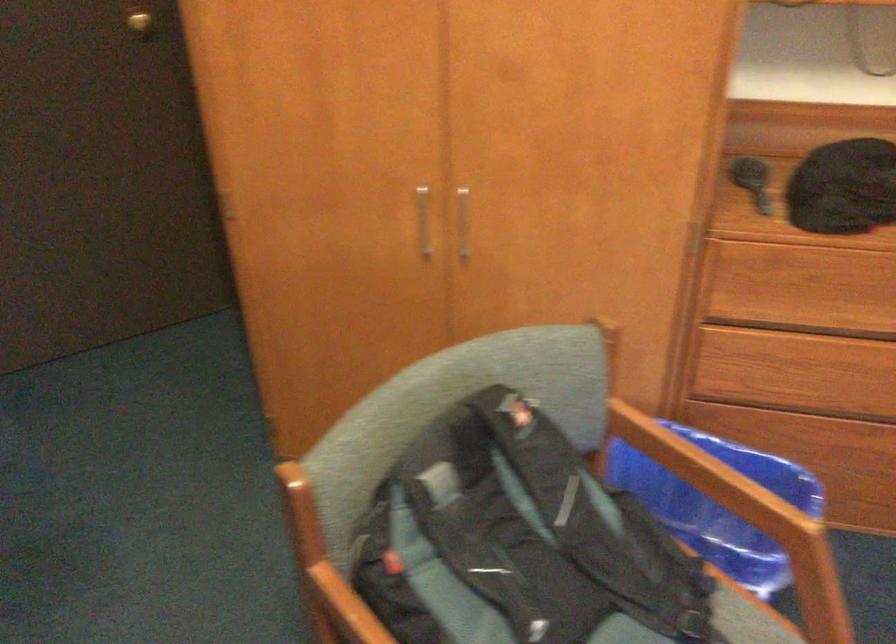
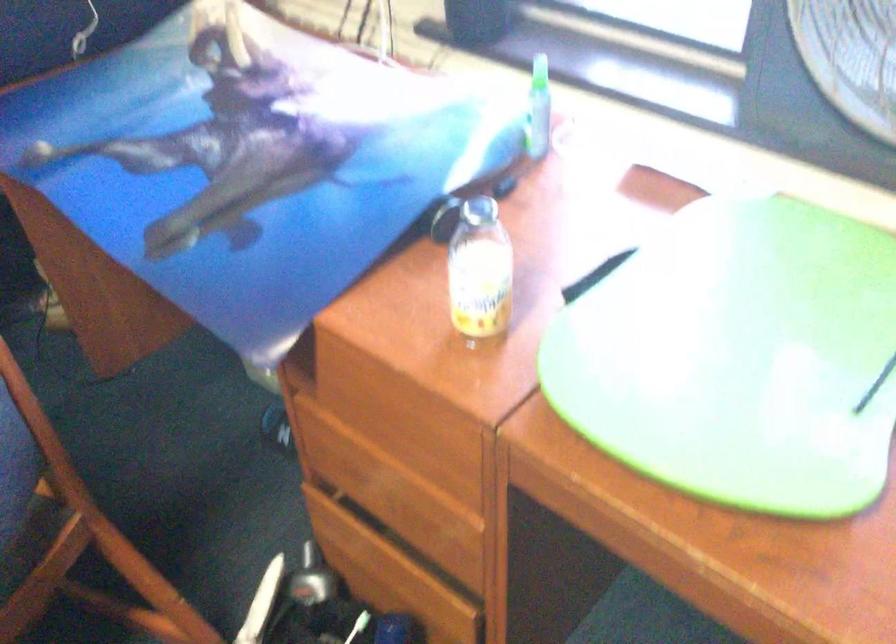
Based on the continuous images, in which direction is the camera rotating?

The rotation direction of the camera is right-down.